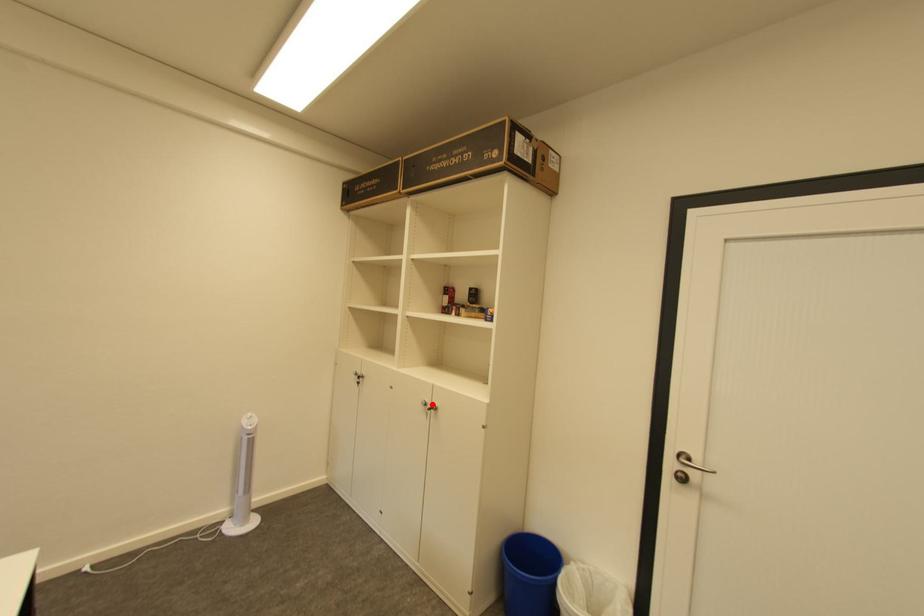
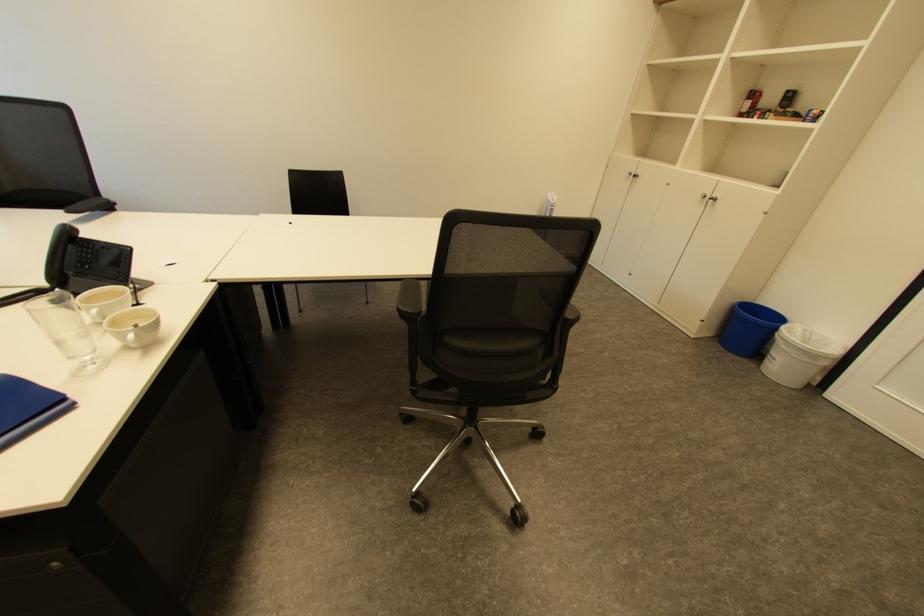
Question: A red point is marked in image1. In image2, is the corresponding 3D point closer to the camera or farther? Reply with the corresponding letter.

Choices:
 (A) The corresponding 3D point is closer.
 (B) The corresponding 3D point is farther.

Answer: (A)